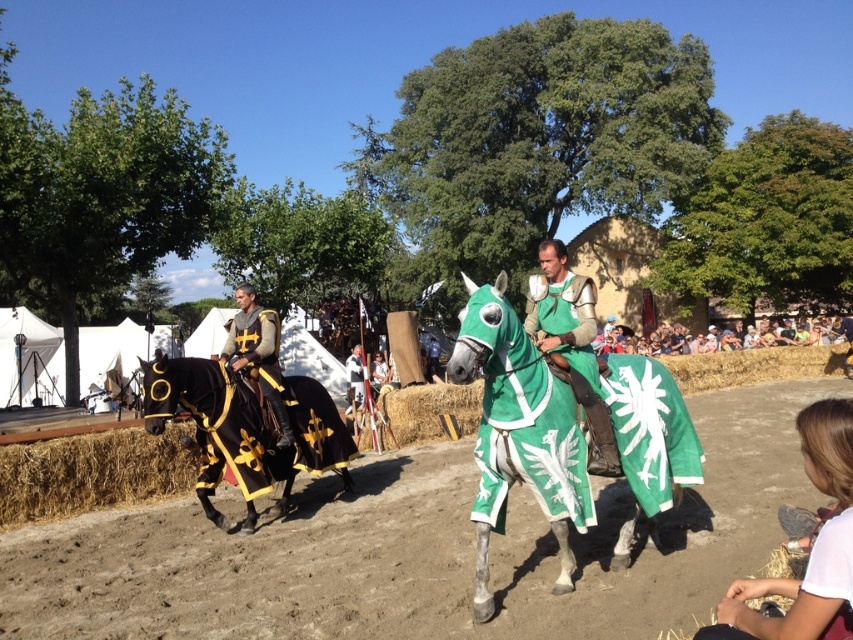
You are a knight in the medieval festival, and you need to set up a tent. The dirt field at center and the green fabric horse at center are in your way. Which object is shorter so you can place the tent there?

The dirt field at center is not as tall as the green fabric horse at center, so the dirt field at center is shorter and suitable for placing the tent.

You are a knight in the medieval festival and need to position two flags at the points marked as point (296, 435) and point (268, 339). According to the scene, which flag should be placed closer to the front of the event area?

Point (268, 339) should be placed closer to the front because it is in front of point (296, 435).